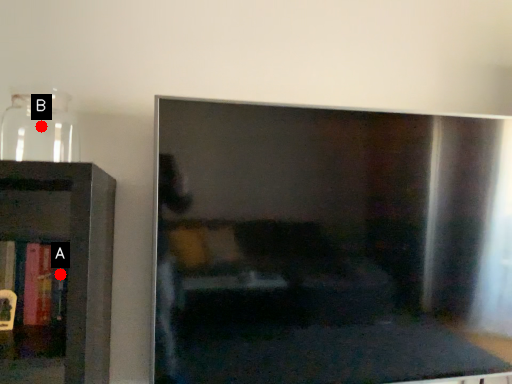
Question: Two points are circled on the image, labeled by A and B beside each circle. Which of the following is the closest to the observer?

Choices:
 (A) A is closer
 (B) B is closer

Answer: (A)